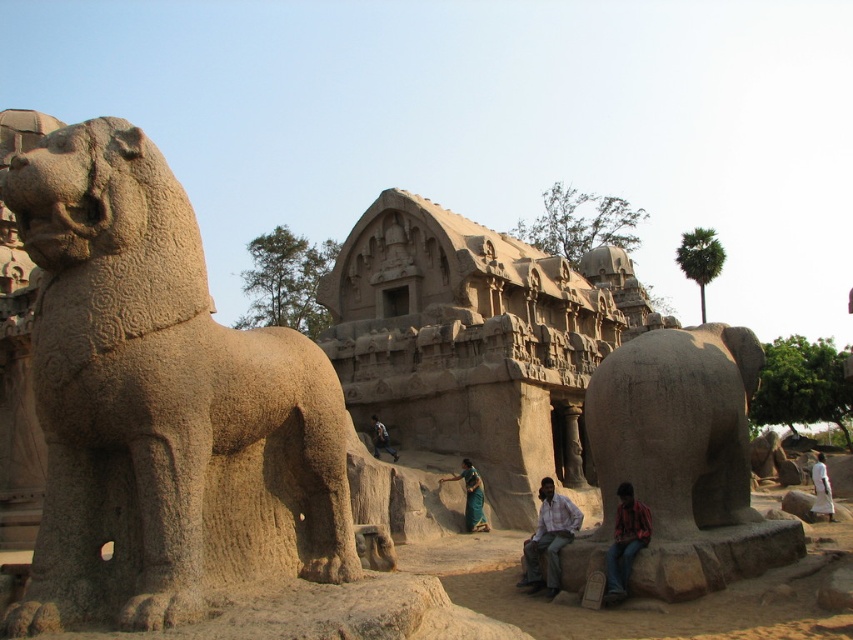
Which is in front, point (440, 480) or point (389, 444)?

Point (440, 480) is more forward.

This screenshot has height=640, width=853. I want to click on green silk saree at center, so click(x=471, y=497).

At what (x,y) coordinates should I click in order to perform the action: click on green silk saree at center. Please return your answer as a coordinate pair (x, y). The width and height of the screenshot is (853, 640). Looking at the image, I should click on (471, 497).

At what (x,y) coordinates should I click in order to perform the action: click on green silk saree at center. Please return your answer as a coordinate pair (x, y). Looking at the image, I should click on (471, 497).

Does gray stone elephant at right appear on the right side of green silk saree at center?

Yes, gray stone elephant at right is to the right of green silk saree at center.

Between gray stone elephant at right and green silk saree at center, which one appears on the left side from the viewer's perspective?

green silk saree at center is more to the left.

At what (x,y) coordinates should I click in order to perform the action: click on gray stone elephant at right. Please return your answer as a coordinate pair (x, y). The width and height of the screenshot is (853, 640). Looking at the image, I should click on (676, 426).

Where is `gray stone elephant at right`? Image resolution: width=853 pixels, height=640 pixels. gray stone elephant at right is located at coordinates (676, 426).

Can you confirm if gray stone elephant at right is smaller than light brown stone statue at center?

No, gray stone elephant at right is not smaller than light brown stone statue at center.

Is point (616, 435) in front of point (560, 540)?

That is True.

Identify the location of gray stone elephant at right. The image size is (853, 640). (676, 426).